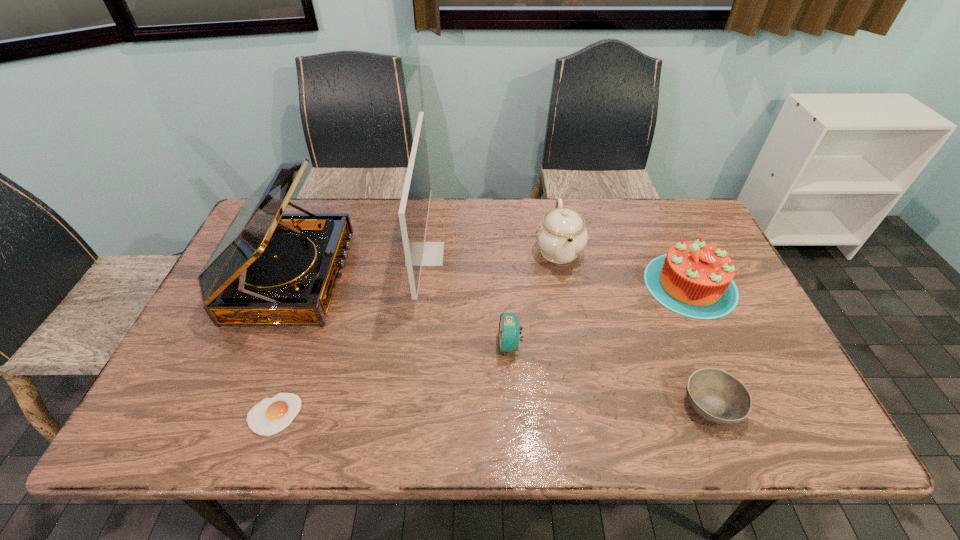
Image resolution: width=960 pixels, height=540 pixels. Identify the location of the third object from left to right. (413, 212).

Identify the location of the second tallest object. The width and height of the screenshot is (960, 540). (269, 269).

Find the location of a particular element. chinaware is located at coordinates (561, 235).

Where is `cake`? This screenshot has width=960, height=540. cake is located at coordinates (695, 279).

The width and height of the screenshot is (960, 540). What are the coordinates of `the third shortest object` in the screenshot? It's located at (509, 332).

At what (x,y) coordinates should I click in order to perform the action: click on alarm clock. Please return your answer as a coordinate pair (x, y). The height and width of the screenshot is (540, 960). Looking at the image, I should click on (509, 332).

Locate an element on the screen. bowl is located at coordinates (717, 396).

Where is `the shortest object`? The width and height of the screenshot is (960, 540). the shortest object is located at coordinates (268, 417).

I want to click on free space located on the front-facing side of the monitor, so click(539, 254).

You are a GUI agent. You are given a task and a screenshot of the screen. Output one action in this format:
    pyautogui.click(x=<x>, y=<y>)
    Task: Click on the vacant space located 0.170m on the front-facing side of the second tallest object
    The width and height of the screenshot is (960, 540).
    Given the screenshot: What is the action you would take?
    pyautogui.click(x=405, y=276)